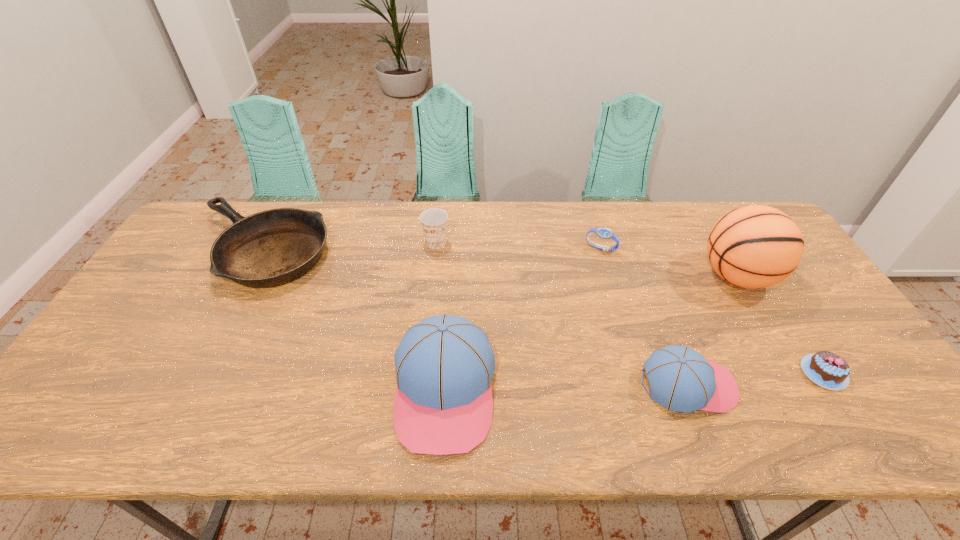
At what (x,y) coordinates should I click in order to perform the action: click on blank space located on the right of the leftmost object. Please return your answer as a coordinate pair (x, y). Looking at the image, I should click on (450, 249).

Identify the location of free location located on the left of the basketball. This screenshot has height=540, width=960. (675, 276).

Identify the location of blank area located on the left of the Dixie cup. [x=404, y=242].

This screenshot has width=960, height=540. I want to click on free spot located 0.060m on the right of the chocolate cake, so click(x=870, y=373).

Identify the location of watch located at the far edge. (604, 233).

Where is `frying pan at the far edge`? The image size is (960, 540). frying pan at the far edge is located at coordinates (270, 248).

Image resolution: width=960 pixels, height=540 pixels. Find the location of `Dixie cup present at the far edge`. Dixie cup present at the far edge is located at coordinates (434, 221).

Where is `chocolate cake located in the near edge section of the desktop`? chocolate cake located in the near edge section of the desktop is located at coordinates click(x=828, y=370).

Find the location of `object situated at the left edge`. object situated at the left edge is located at coordinates (270, 248).

Find the location of a particular element. basketball that is at the right edge is located at coordinates (755, 246).